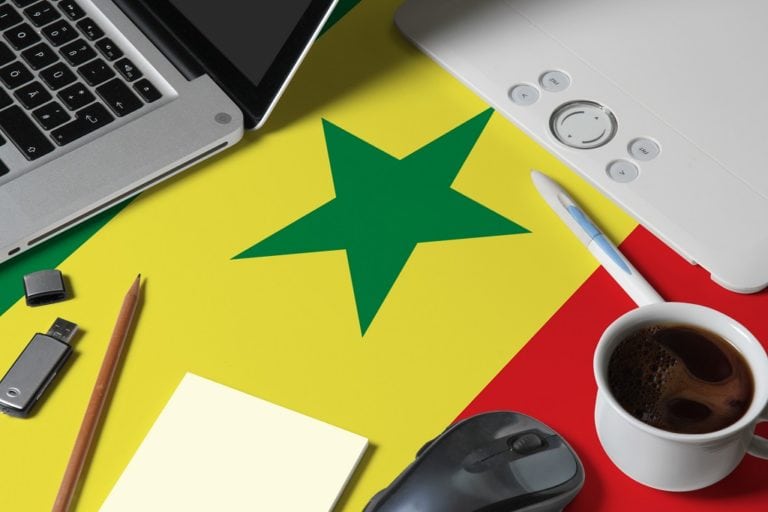
Where is `coffee in cup`? coffee in cup is located at coordinates (689, 384).